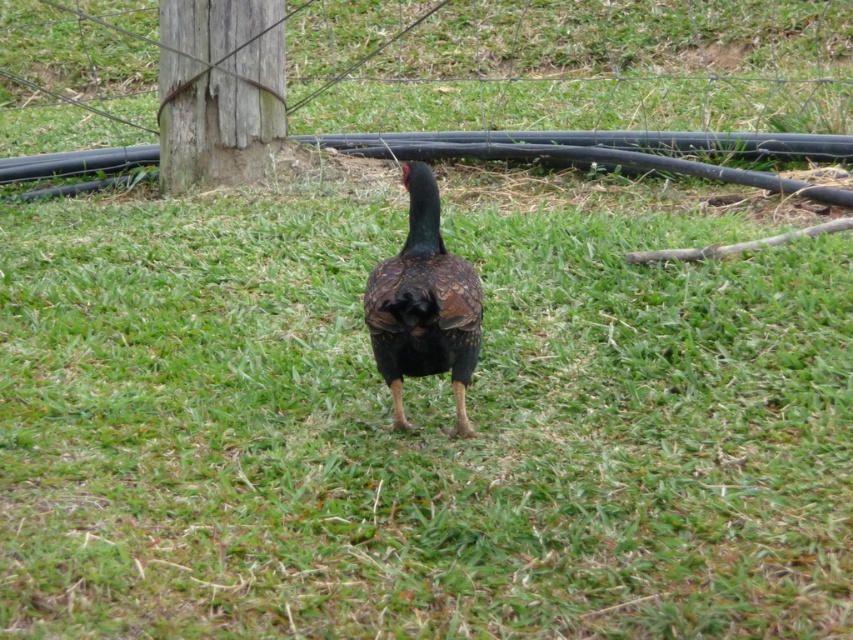
Is wooden post at center in front of shiny brown bird at center?

That is False.

Between point (553, 100) and point (450, 292), which one is positioned in front?

Point (450, 292) is more forward.

Which is behind, point (560, 1) or point (428, 182)?

Positioned behind is point (560, 1).

Where is `wooden post at center`? This screenshot has height=640, width=853. wooden post at center is located at coordinates (575, 74).